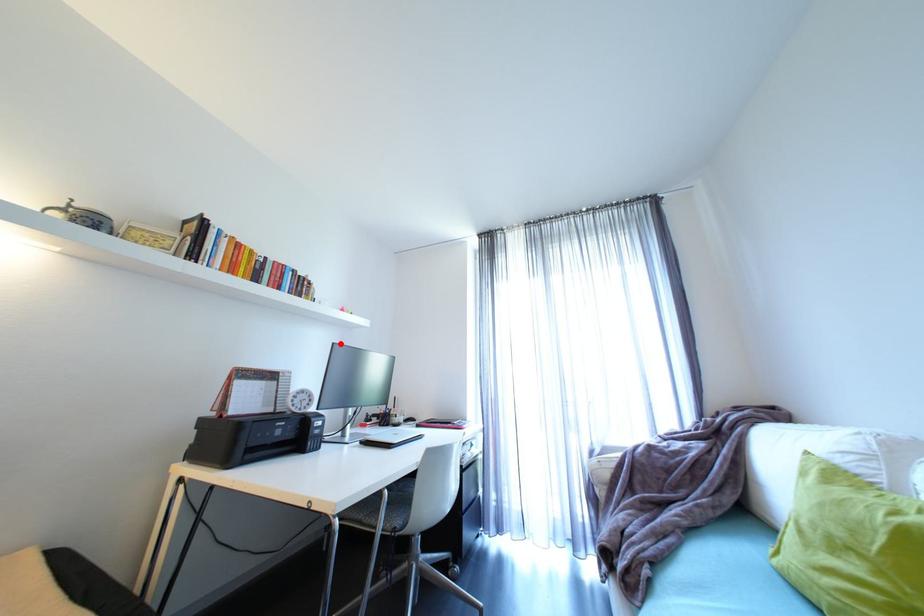
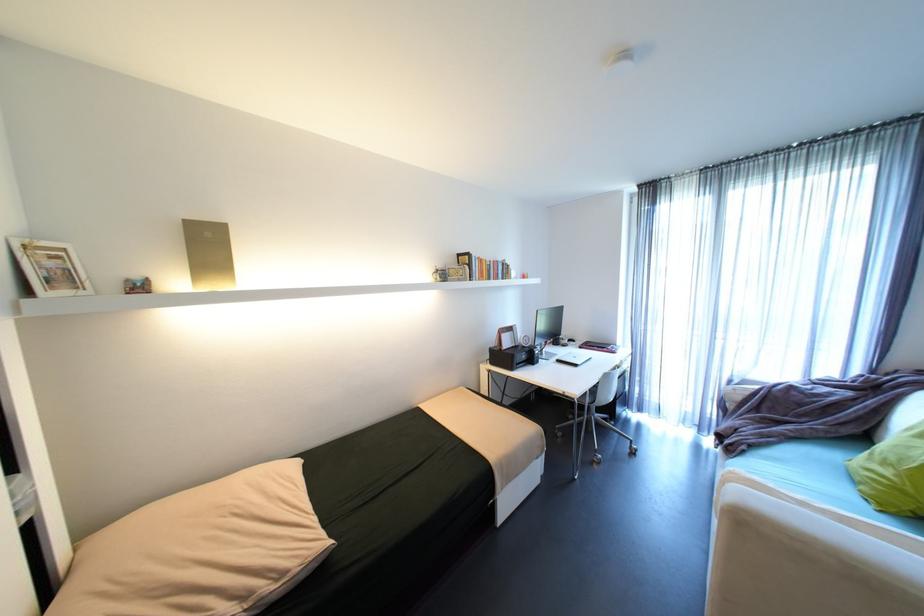
Find the pixel in the second image that matches the highlighted location in the first image.

(544, 310)